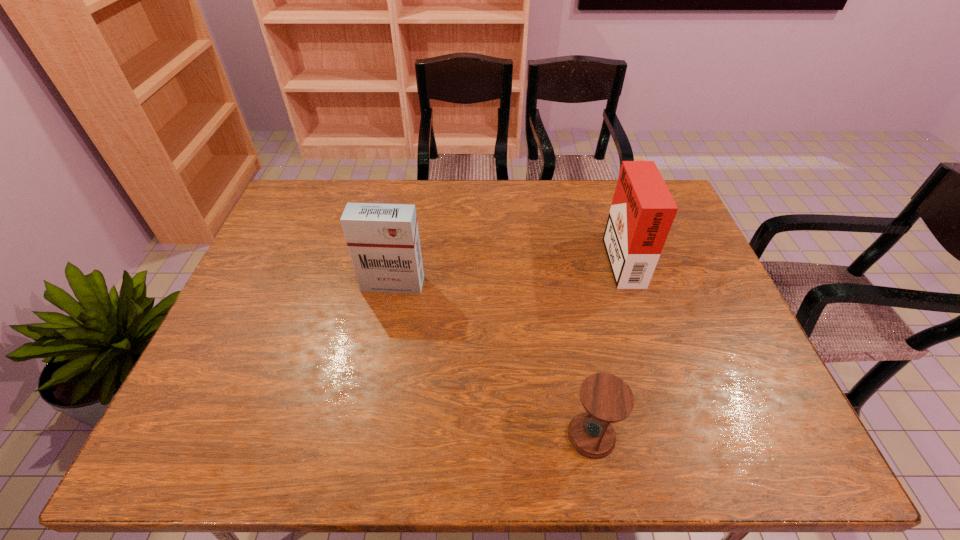
Locate an element on the screen. The height and width of the screenshot is (540, 960). free space between the rightmost object and the leftmost object is located at coordinates (507, 270).

Identify the location of vacant space in between the right cigarette case and the shortest object. tap(607, 346).

Image resolution: width=960 pixels, height=540 pixels. What are the coordinates of `empty space between the leftmost object and the shortest object` in the screenshot? It's located at tap(492, 360).

I want to click on empty space that is in between the leftmost object and the rightmost object, so point(507,270).

Identify the location of empty space that is in between the right cigarette case and the nearest object. The image size is (960, 540). (607, 346).

Image resolution: width=960 pixels, height=540 pixels. Identify the location of the closest object to the left cigarette case. (607, 399).

Choose which object is the nearest neighbor to the nearest object. Please provide its 2D coordinates. Your answer should be formatted as a tuple, i.e. [(x, y)], where the tuple contains the x and y coordinates of a point satisfying the conditions above.

[(642, 211)]

In order to click on vacant space that satisfies the following two spatial constraints: 1. on the front side of the nearest object; 2. on the left side of the left cigarette case in this screenshot , I will do `click(364, 435)`.

Identify the location of vacant space that satisfies the following two spatial constraints: 1. on the front-facing side of the rightmost object; 2. on the front side of the leftmost object. (631, 284).